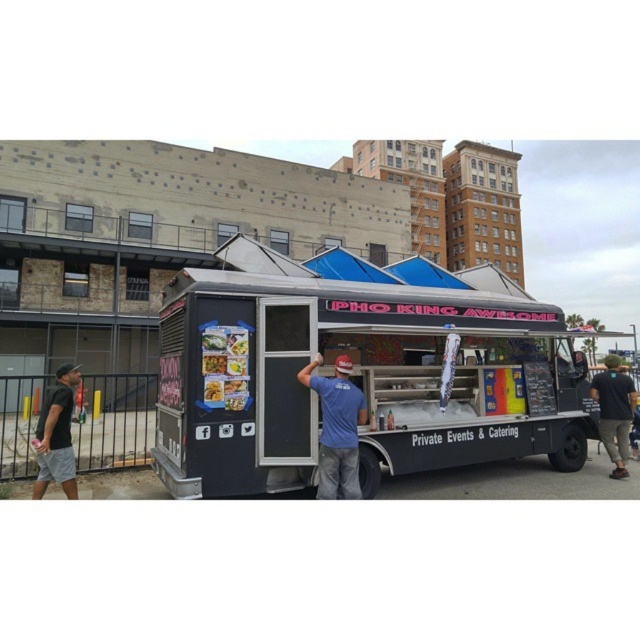
Is black cotton shirt at left below matte plastic food at center?

Yes, black cotton shirt at left is below matte plastic food at center.

Is point (44, 486) positioned behind point (204, 380)?

Yes, it is behind point (204, 380).

Identify the location of black cotton shirt at left. The width and height of the screenshot is (640, 640). (56, 435).

Who is lower down, blue cotton shirt at center or smooth glossy rice noodles at center?

Positioned lower is blue cotton shirt at center.

Is point (355, 417) less distant than point (209, 362)?

That is False.

The width and height of the screenshot is (640, 640). Identify the location of blue cotton shirt at center. (337, 428).

Between black cotton shirt at left and smooth glossy rice noodles at center, which one is positioned higher?

Positioned higher is smooth glossy rice noodles at center.

Where is `black cotton shirt at left`? black cotton shirt at left is located at coordinates (56, 435).